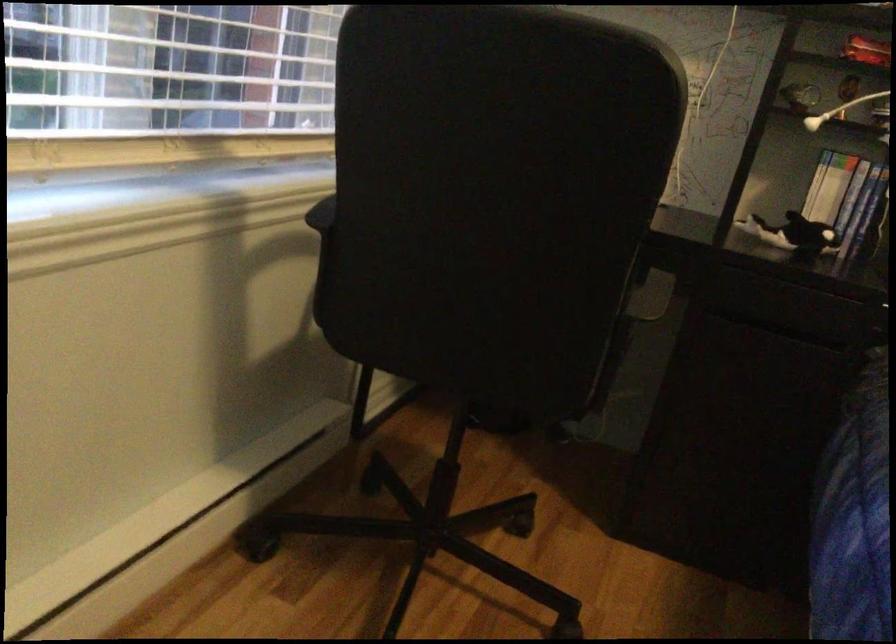
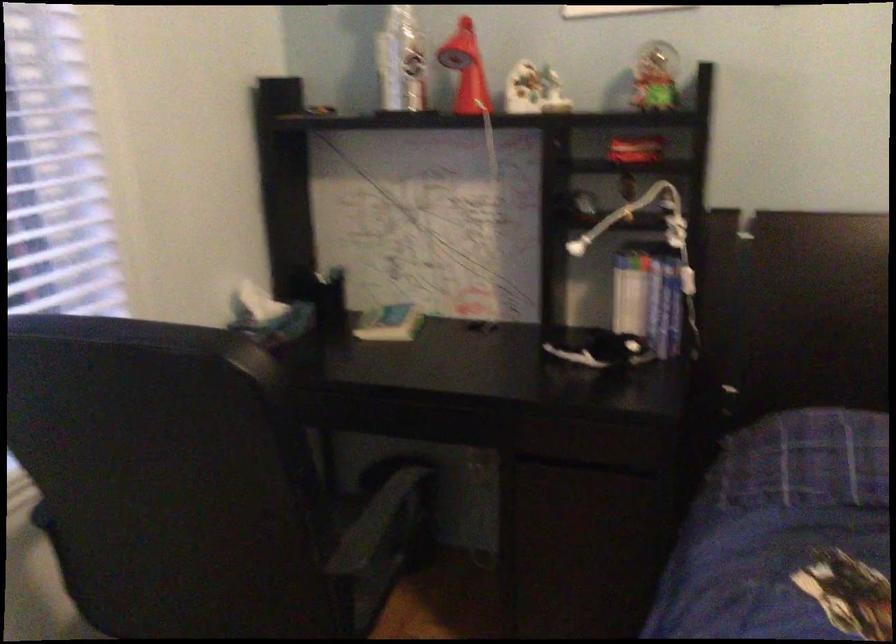
Question: Based on the continuous images, in which direction is the camera rotating? Reply with the corresponding letter.

Choices:
 (A) Left
 (B) Right
 (C) Up
 (D) Down

Answer: (A)